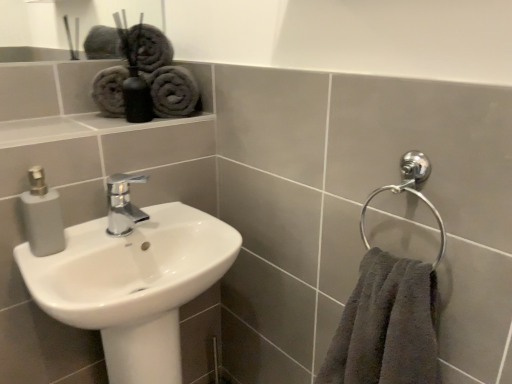
Where is `dark gray plush towel at right`? The width and height of the screenshot is (512, 384). dark gray plush towel at right is located at coordinates (386, 326).

Measure the distance between white glossy sink at lower left and camera.

The depth of white glossy sink at lower left is 73.09 centimeters.

At what (x,y) coordinates should I click in order to perform the action: click on polished chrome faucet at center. Please return your answer as a coordinate pair (x, y). Looking at the image, I should click on (123, 204).

From the image's perspective, which one is positioned lower, gray cotton towels at upper left or polished chrome faucet at center?

polished chrome faucet at center appears lower in the image.

Between gray cotton towels at upper left and polished chrome faucet at center, which one has more height?

Standing taller between the two is gray cotton towels at upper left.

Considering the points (170, 109) and (128, 178), which point is behind, point (170, 109) or point (128, 178)?

The point (170, 109) is more distant.

Consider the image. Is the depth of gray cotton towels at upper left less than that of polished chrome faucet at center?

No, it is not.

Is dark gray plush towel at right positioned beyond the bounds of white glossy sink at lower left?

Indeed, dark gray plush towel at right is completely outside white glossy sink at lower left.

What's the angular difference between dark gray plush towel at right and white glossy sink at lower left's facing directions?

dark gray plush towel at right and white glossy sink at lower left are facing 88.5 degrees away from each other.

Considering the positions of objects dark gray plush towel at right and white glossy sink at lower left in the image provided, who is more to the right, dark gray plush towel at right or white glossy sink at lower left?

dark gray plush towel at right is more to the right.

Considering the relative positions of dark gray plush towel at right and white glossy sink at lower left in the image provided, is dark gray plush towel at right in front of white glossy sink at lower left?

Yes, dark gray plush towel at right is in front of white glossy sink at lower left.

From the picture: From a real-world perspective, is dark gray plush towel at right on top of gray cotton towels at upper left?

Incorrect, from a real-world perspective, dark gray plush towel at right is lower than gray cotton towels at upper left.

Which object is thinner, dark gray plush towel at right or gray cotton towels at upper left?

With smaller width is gray cotton towels at upper left.

Would you say dark gray plush towel at right is to the left or to the right of gray cotton towels at upper left in the picture?

From the image, it's evident that dark gray plush towel at right is to the right of gray cotton towels at upper left.

How far apart are dark gray plush towel at right and gray cotton towels at upper left?

dark gray plush towel at right and gray cotton towels at upper left are 27.40 inches apart from each other.

Who is smaller, gray cotton towels at upper left or dark gray plush towel at right?

gray cotton towels at upper left is smaller.

Is point (159, 86) closer or farther from the camera than point (413, 313)?

Point (159, 86).

Which object is positioned more to the right, gray cotton towels at upper left or dark gray plush towel at right?

dark gray plush towel at right is more to the right.

Is gray cotton towels at upper left situated inside dark gray plush towel at right or outside?

gray cotton towels at upper left is located beyond the bounds of dark gray plush towel at right.

Looking at their sizes, would you say white glossy sink at lower left is wider or thinner than dark gray plush towel at right?

In the image, white glossy sink at lower left appears to be wider than dark gray plush towel at right.

Locate an element on the screen. The image size is (512, 384). sink below the dark gray plush towel at right (from a real-world perspective) is located at coordinates (132, 280).

Considering the positions of objects white glossy sink at lower left and dark gray plush towel at right in the image provided, who is more to the right, white glossy sink at lower left or dark gray plush towel at right?

From the viewer's perspective, dark gray plush towel at right appears more on the right side.

Who is bigger, dark gray plush towel at right or polished chrome faucet at center?

Bigger between the two is dark gray plush towel at right.

Considering the relative sizes of dark gray plush towel at right and polished chrome faucet at center in the image provided, is dark gray plush towel at right wider than polished chrome faucet at center?

Correct, the width of dark gray plush towel at right exceeds that of polished chrome faucet at center.

The height and width of the screenshot is (384, 512). I want to click on tap that appears above the dark gray plush towel at right (from the image's perspective), so click(x=123, y=204).

From the image's perspective, who appears lower, polished chrome faucet at center or white glossy sink at lower left?

From the image's view, white glossy sink at lower left is below.

Locate an element on the screen. The height and width of the screenshot is (384, 512). tap on the left side of white glossy sink at lower left is located at coordinates (123, 204).

Relative to white glossy sink at lower left, is polished chrome faucet at center in front or behind?

Clearly, polished chrome faucet at center is behind white glossy sink at lower left.

Are polished chrome faucet at center and white glossy sink at lower left located far from each other?

No, polished chrome faucet at center is not far away from white glossy sink at lower left.

I want to click on tap below the gray cotton towels at upper left (from the image's perspective), so click(x=123, y=204).

Find the location of a particular element. towel in front of the white glossy sink at lower left is located at coordinates (386, 326).

From the picture: Looking at the image, which one is located further to gray cotton towels at upper left, dark gray plush towel at right or polished chrome faucet at center?

dark gray plush towel at right lies further to gray cotton towels at upper left than the other object.

Based on their spatial positions, is gray cotton towels at upper left or polished chrome faucet at center closer to dark gray plush towel at right?

Among the two, polished chrome faucet at center is located nearer to dark gray plush towel at right.

Estimate the real-world distances between objects in this image. Which object is closer to dark gray plush towel at right, polished chrome faucet at center or gray cotton towels at upper left?

polished chrome faucet at center lies closer to dark gray plush towel at right than the other object.

Estimate the real-world distances between objects in this image. Which object is further from white glossy sink at lower left, polished chrome faucet at center or gray cotton towels at upper left?

gray cotton towels at upper left is further to white glossy sink at lower left.

When comparing their distances from gray cotton towels at upper left, does dark gray plush towel at right or white glossy sink at lower left seem further?

dark gray plush towel at right is positioned further to the anchor gray cotton towels at upper left.

Estimate the real-world distances between objects in this image. Which object is closer to polished chrome faucet at center, gray cotton towels at upper left or dark gray plush towel at right?

gray cotton towels at upper left lies closer to polished chrome faucet at center than the other object.

In the scene shown: Which object lies further to the anchor point dark gray plush towel at right, gray cotton towels at upper left or white glossy sink at lower left?

Based on the image, gray cotton towels at upper left appears to be further to dark gray plush towel at right.

From the picture: Looking at the image, which one is located further to white glossy sink at lower left, dark gray plush towel at right or gray cotton towels at upper left?

gray cotton towels at upper left is positioned further to the anchor white glossy sink at lower left.

The image size is (512, 384). What are the coordinates of `tap between gray cotton towels at upper left and white glossy sink at lower left in the up-down direction` in the screenshot? It's located at (123, 204).

Find the location of a particular element. The height and width of the screenshot is (384, 512). sink situated between polished chrome faucet at center and dark gray plush towel at right from left to right is located at coordinates (132, 280).

At what (x,y) coordinates should I click in order to perform the action: click on tap between gray cotton towels at upper left and dark gray plush towel at right in the up-down direction. Please return your answer as a coordinate pair (x, y). Looking at the image, I should click on (123, 204).

Image resolution: width=512 pixels, height=384 pixels. What are the coordinates of `towel between gray cotton towels at upper left and white glossy sink at lower left vertically` in the screenshot? It's located at (386, 326).